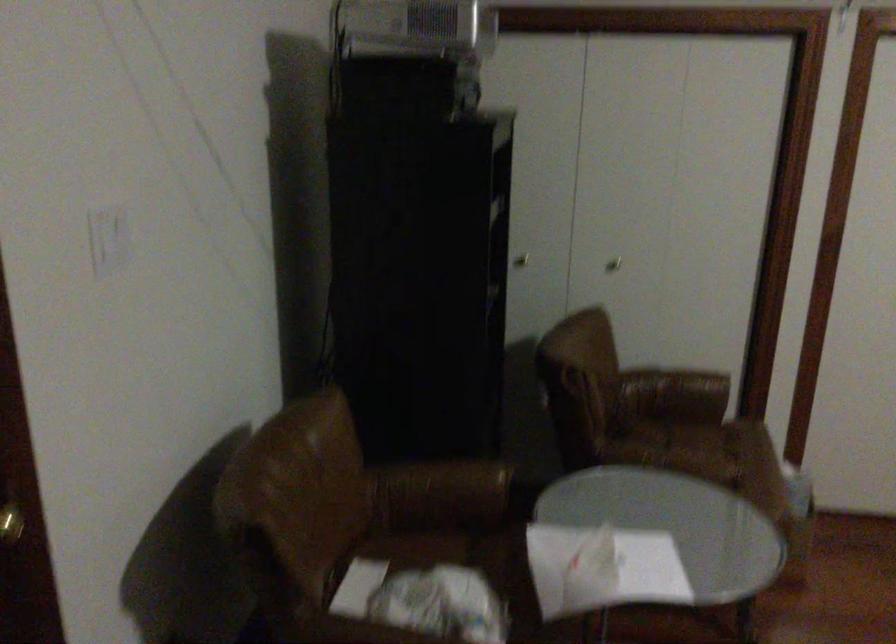
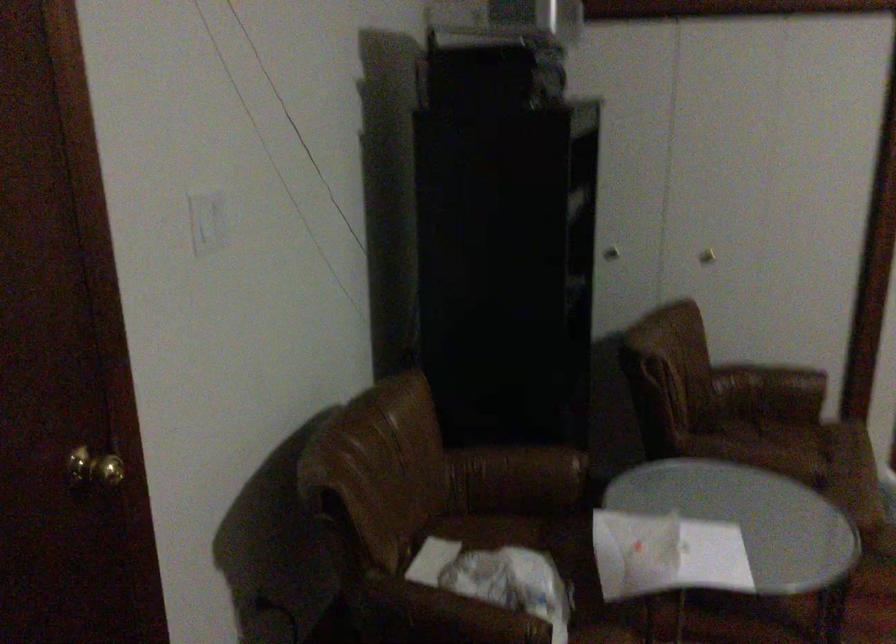
Question: Based on the continuous images, in which direction is the camera rotating? Reply with the corresponding letter.

Choices:
 (A) Left
 (B) Right
 (C) Up
 (D) Down

Answer: (A)